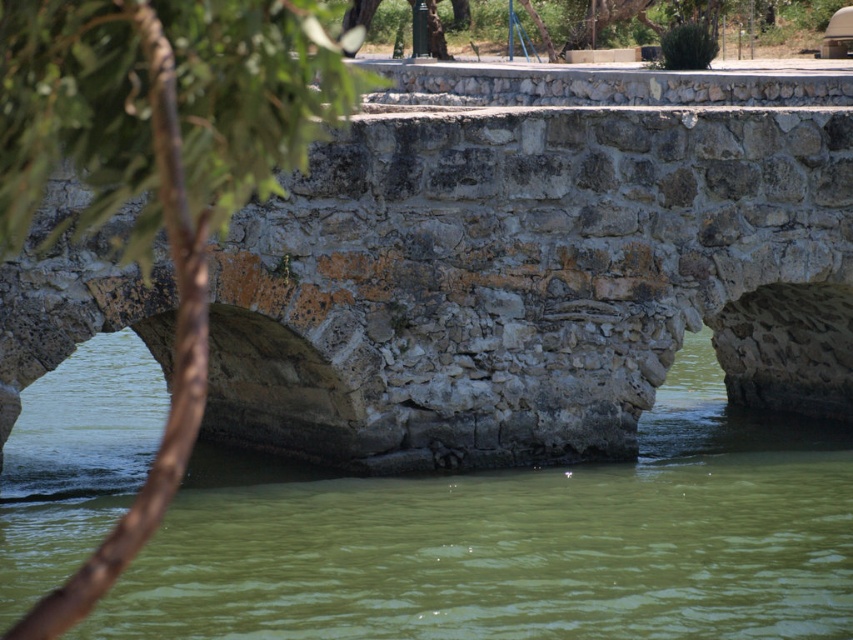
You are standing on the stone bridge and want to know the exact position of the green stone river at center. What are its coordinates?

The green stone river at center is located at point (515, 540).

You are standing on the stone bridge and looking down. You see the green stone river at center and the green leafy tree at upper center. Which object is closer to your eyes?

The green leafy tree at upper center is closer to your eyes because it is positioned above the green stone river at center.

You are standing on the stone bridge and want to determine which of the two points, point (724, 410) or point (245, 4), is closer to you. Based on the scene, which point is nearer?

Point (724, 410) is further to the viewer than point (245, 4), so the closer point to you is point (245, 4).